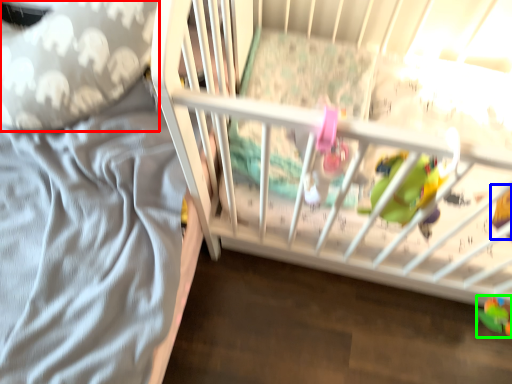
Question: Considering the real-world distances, which object is closest to throw pillow (highlighted by a red box)? toy (highlighted by a blue box) or toy (highlighted by a green box).

Choices:
 (A) toy
 (B) toy

Answer: (A)